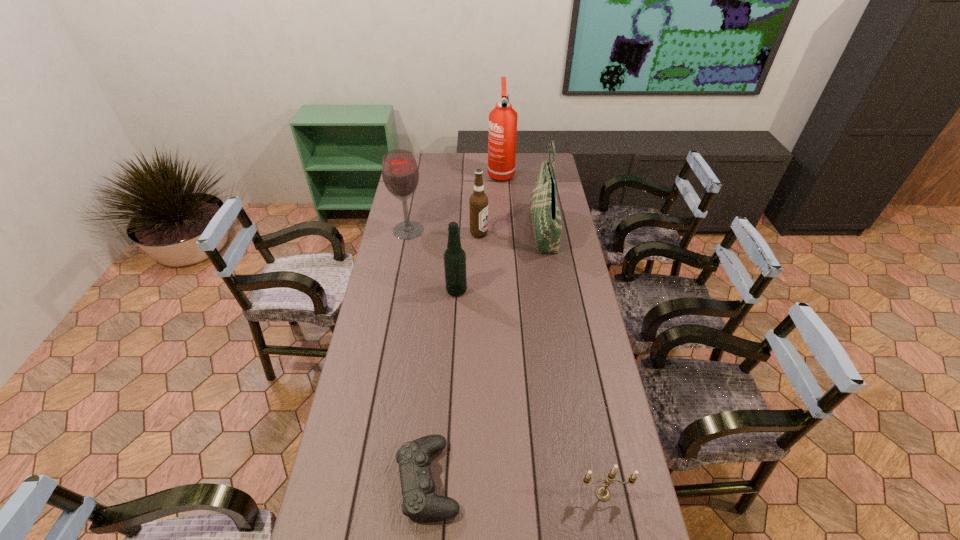
You are a GUI agent. You are given a task and a screenshot of the screen. Output one action in this format:
    pyautogui.click(x=<x>, y=<y>)
    Task: Click on the blank space located on the back of the tote bag
    The image size is (960, 540).
    Given the screenshot: What is the action you would take?
    pyautogui.click(x=533, y=169)

Identify the location of vacant space located 0.130m on the right of the leftmost alcohol. (455, 230).

Locate an element on the screen. Image resolution: width=960 pixels, height=540 pixels. free space located 0.090m on the back of the third nearest object is located at coordinates coord(458,267).

This screenshot has width=960, height=540. Find the location of `free space located on the label of the rightmost alcohol`. free space located on the label of the rightmost alcohol is located at coordinates (563, 233).

Find the location of a particular element. Image resolution: width=960 pixels, height=540 pixels. free space located 0.270m on the back of the sixth tallest object is located at coordinates (584, 393).

Image resolution: width=960 pixels, height=540 pixels. In order to click on free space located 0.140m on the left of the shortest object in this screenshot , I will do `click(342, 479)`.

Where is `object located at the far edge`? This screenshot has width=960, height=540. object located at the far edge is located at coordinates pos(502,134).

I want to click on object present at the left edge, so click(400, 173).

Identify the location of tote bag situated at the right edge. (546, 219).

This screenshot has height=540, width=960. I want to click on candle that is positioned at the right edge, so click(x=602, y=492).